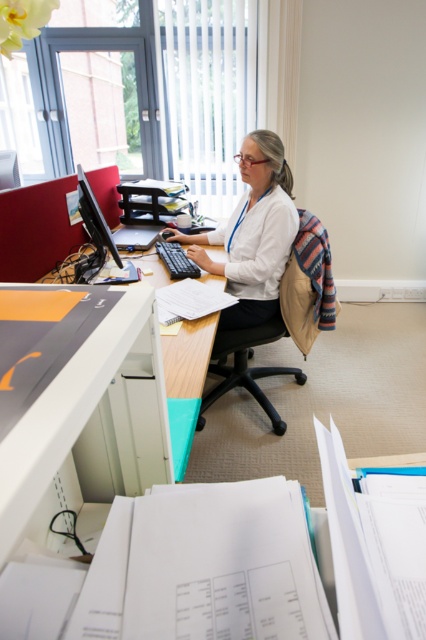
Question: Considering the real-world distances, which object is farthest from the matte black monitor at left?

Choices:
 (A) wooden desk at center
 (B) black fabric swivel chair at center

Answer: (B)

Question: Which of these objects is positioned farthest from the white matte shirt at center?

Choices:
 (A) matte black monitor at left
 (B) wooden desk at center
 (C) black fabric swivel chair at center

Answer: (B)

Question: Considering the relative positions of black fabric swivel chair at center and matte black monitor at left in the image provided, where is black fabric swivel chair at center located with respect to matte black monitor at left?

Choices:
 (A) below
 (B) above

Answer: (A)

Question: Considering the relative positions of white matte shirt at center and wooden desk at center in the image provided, where is white matte shirt at center located with respect to wooden desk at center?

Choices:
 (A) below
 (B) above

Answer: (B)

Question: Is black fabric swivel chair at center wider than matte black monitor at left?

Choices:
 (A) yes
 (B) no

Answer: (A)

Question: Which of these objects is positioned closest to the black fabric swivel chair at center?

Choices:
 (A) wooden desk at center
 (B) matte black monitor at left
 (C) white matte shirt at center

Answer: (C)